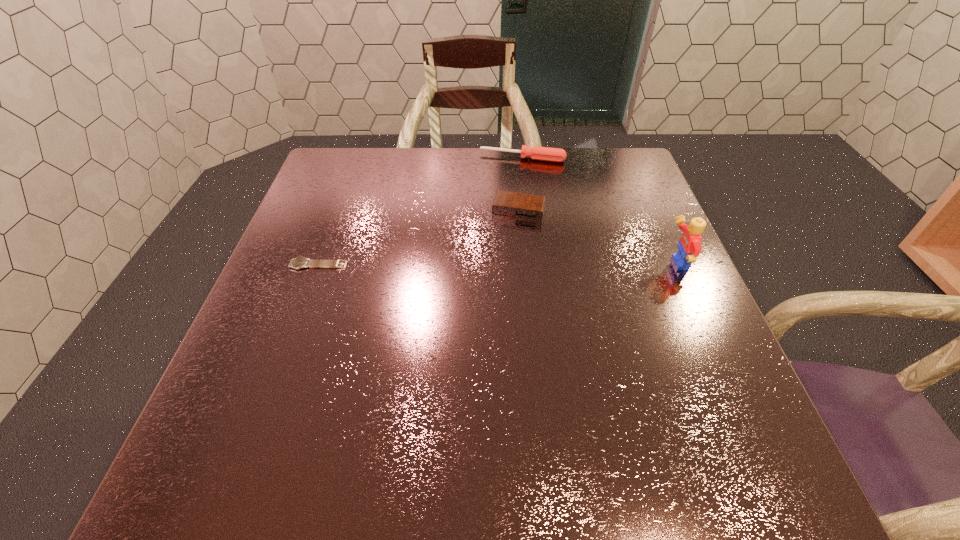
Where is `vacant space at the near edge of the desktop`? The image size is (960, 540). vacant space at the near edge of the desktop is located at coordinates (466, 423).

The width and height of the screenshot is (960, 540). In the image, there is a desktop. In order to click on vacant space at the left edge in this screenshot , I will do `click(305, 368)`.

This screenshot has height=540, width=960. What are the coordinates of `vacant space at the right edge of the desktop` in the screenshot? It's located at (657, 227).

Find the location of a particular element. free space at the far left corner of the desktop is located at coordinates (350, 190).

This screenshot has height=540, width=960. What are the coordinates of `vacant point at the near left corner` in the screenshot? It's located at (228, 396).

The height and width of the screenshot is (540, 960). I want to click on free space at the far right corner of the desktop, so click(x=602, y=154).

Find the location of a particular element. unoccupied area between the screwdriver and the leftmost object is located at coordinates (420, 211).

Where is `empty space between the third nearest object and the Lego`? empty space between the third nearest object and the Lego is located at coordinates (597, 237).

The image size is (960, 540). I want to click on vacant area that lies between the screwdriver and the tallest object, so click(599, 211).

At what (x,y) coordinates should I click in order to perform the action: click on free spot between the farthest object and the watch. Please return your answer as a coordinate pair (x, y). Looking at the image, I should click on (420, 211).